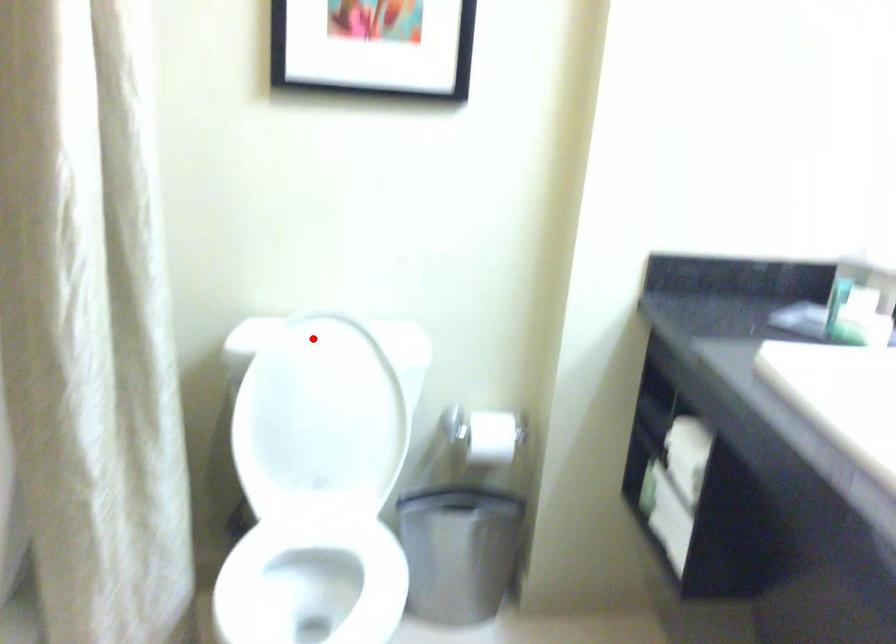
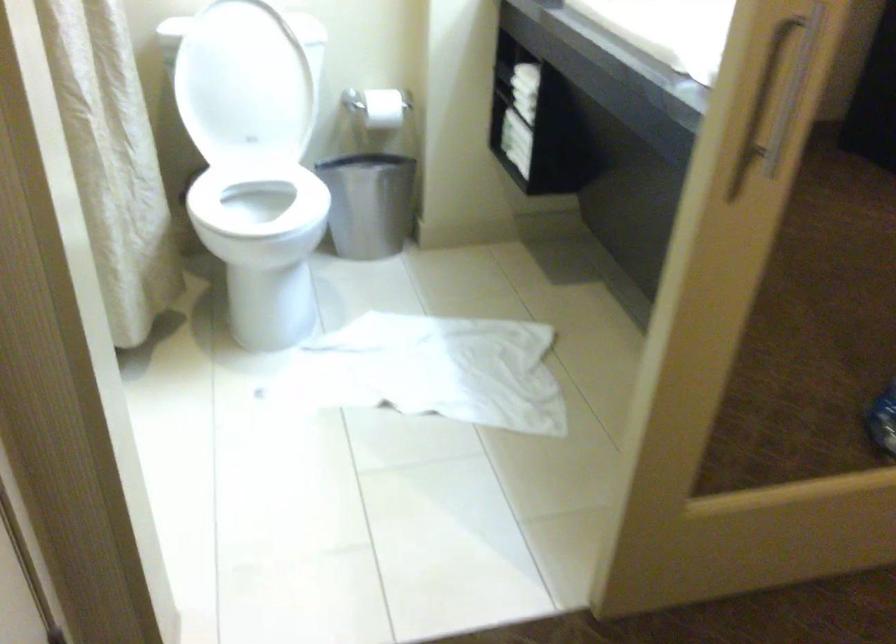
Question: I am providing you with two images of the same scene from different viewpoints. In image1, a red point is highlighted. Considering the same 3D point in image2, which of the following is correct?

Choices:
 (A) It is closer
 (B) It is farther

Answer: (B)